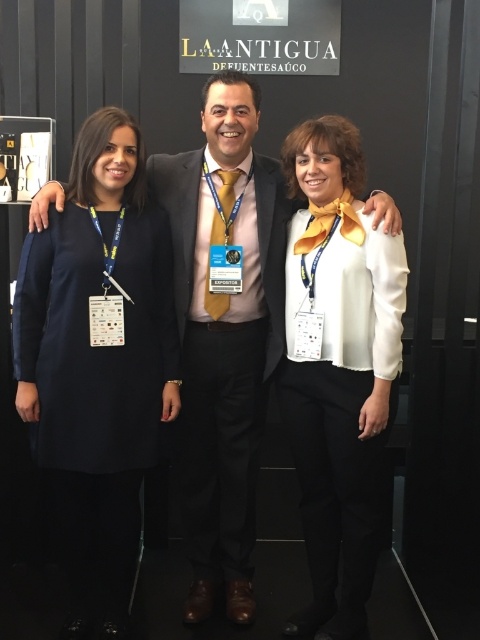
You are organizing a fashion show and need to arrange two suits displayed in the image. The matte black suit at center and the satin black suit at center must be placed on mannequins. Since the mannequins have height restrictions, which suit should be placed on the taller mannequin?

The matte black suit at center should be placed on the taller mannequin because it has a greater height compared to the satin black suit at center.

You are organizing a fashion show and need to arrange two suits displayed in the image. Which suit, the matte black suit at center or the satin black suit at center, has a narrower width and should be placed on the narrower mannequin?

The matte black suit at center has a lesser width compared to the satin black suit at center, so it should be placed on the narrower mannequin.